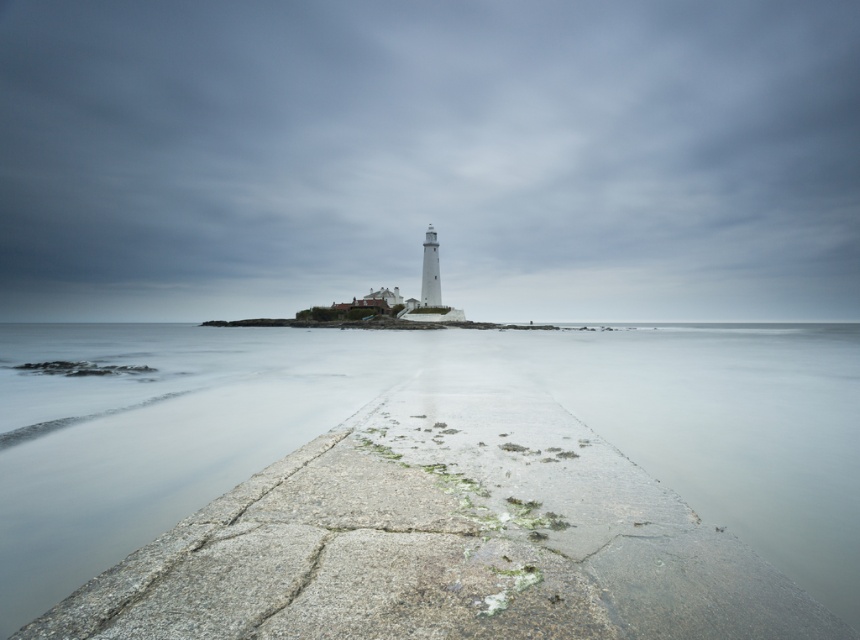
You are a ship captain navigating near the coast. Your GPS shows your current position as point 0.250, 0.500. Is the white concrete lighthouse at center visible from your current location?

The white concrete lighthouse at center is located at point (430, 157), which is very close to your current position at (430, 160). Since the lighthouse is a prominent structure, it should be visible from your location.

You are a photographer planning to take a wide shot of the white concrete lighthouse at center and the clear water at center. Based on their sizes, which one should you focus on to ensure it dominates the frame?

The white concrete lighthouse at center is larger in size than the clear water at center, so focusing on it will ensure it dominates the frame.

You are a seagull flying over the coastal area. You see the white concrete lighthouse at center and the clear water at center. Which one is higher from the ground level?

The white concrete lighthouse at center is located above clear water at center, so the white concrete lighthouse at center is higher from the ground level.